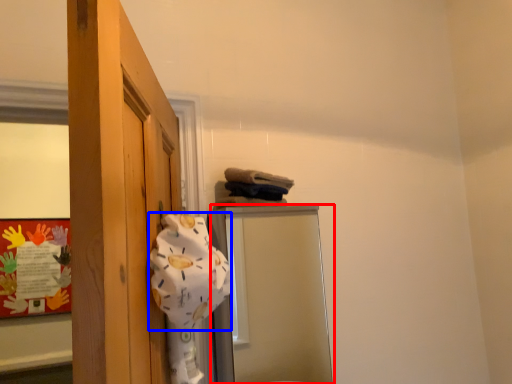
Question: Which point is further to the camera, mirror (highlighted by a red box) or bath towel (highlighted by a blue box)?

Choices:
 (A) mirror
 (B) bath towel

Answer: (A)